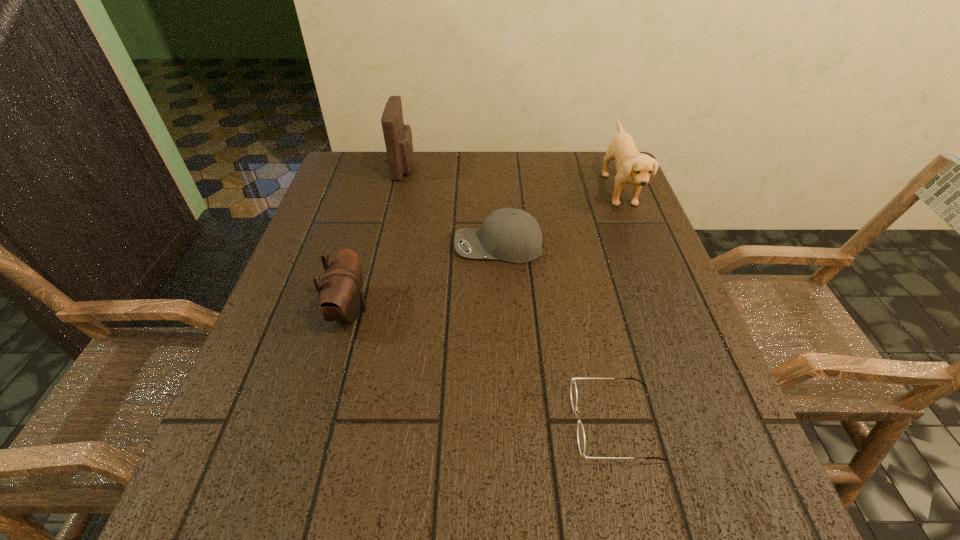
Locate an element on the screen. Image resolution: width=960 pixels, height=540 pixels. free space at the far right corner of the desktop is located at coordinates (602, 167).

At what (x,y) coordinates should I click in order to perform the action: click on empty space between the fourth tallest object and the second object from right to left. Please return your answer as a coordinate pair (x, y). The width and height of the screenshot is (960, 540). Looking at the image, I should click on (557, 335).

Locate an element on the screen. free spot between the third nearest object and the puppy is located at coordinates (559, 218).

Identify the location of empty location between the farther pouch and the shorter pouch. (377, 239).

Image resolution: width=960 pixels, height=540 pixels. What are the coordinates of `vacant space in between the nearest object and the taller pouch` in the screenshot? It's located at (510, 296).

In order to click on vacant space that's between the fourth tallest object and the second nearest object in this screenshot , I will do `click(424, 278)`.

Where is `vacant area that lies between the rightmost object and the farther pouch`? The image size is (960, 540). vacant area that lies between the rightmost object and the farther pouch is located at coordinates (512, 179).

You are a GUI agent. You are given a task and a screenshot of the screen. Output one action in this format:
    pyautogui.click(x=<x>, y=<y>)
    Task: Click on the empty space between the nearer pouch and the farther pouch
    
    Given the screenshot: What is the action you would take?
    pyautogui.click(x=377, y=239)

Where is `blank region between the taller pouch and the fourth farthest object`? The image size is (960, 540). blank region between the taller pouch and the fourth farthest object is located at coordinates (377, 239).

Image resolution: width=960 pixels, height=540 pixels. Identify the location of free area in between the third nearest object and the farther pouch. (451, 207).